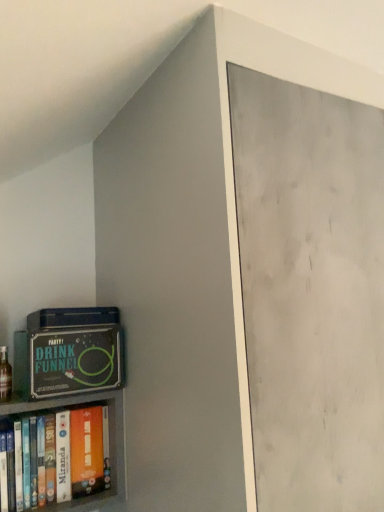
The image size is (384, 512). What are the coordinates of `orange matte book at lower left` in the screenshot? It's located at (111, 467).

Where is `green matte board game at lower left`? The height and width of the screenshot is (512, 384). green matte board game at lower left is located at coordinates (75, 360).

This screenshot has height=512, width=384. I want to click on orange matte book at lower left, so click(111, 467).

From a real-world perspective, is orange matte book at lower left on top of green matte board game at lower left?

No.

How distant is orange matte book at lower left from green matte board game at lower left?

They are 4.23 inches apart.

Is orange matte book at lower left not close to green matte board game at lower left?

orange matte book at lower left is actually quite close to green matte board game at lower left.

Can you confirm if orange matte book at lower left is bigger than green matte board game at lower left?

No.

Does point (79, 344) come farther from viewer compared to point (8, 400)?

No, (79, 344) is in front of (8, 400).

From the image's perspective, between green matte board game at lower left and translucent glass bottle at lower left, which one is located above?

green matte board game at lower left.

Can you confirm if green matte board game at lower left is taller than translucent glass bottle at lower left?

Indeed, green matte board game at lower left has a greater height compared to translucent glass bottle at lower left.

Is green matte board game at lower left oriented towards translucent glass bottle at lower left?

No, green matte board game at lower left is not turned towards translucent glass bottle at lower left.

Which of these two, translucent glass bottle at lower left or orange matte book at lower left, is thinner?

orange matte book at lower left.

Can you see translucent glass bottle at lower left touching orange matte book at lower left?

translucent glass bottle at lower left and orange matte book at lower left are not in contact.

Is point (3, 353) less distant than point (119, 451)?

That is False.

From a real-world perspective, is translucent glass bottle at lower left above or below orange matte book at lower left?

Clearly, from a real-world perspective, translucent glass bottle at lower left is above orange matte book at lower left.

Looking at their sizes, would you say translucent glass bottle at lower left is wider or thinner than green matte board game at lower left?

In the image, translucent glass bottle at lower left appears to be more narrow than green matte board game at lower left.

How different are the orientations of translucent glass bottle at lower left and green matte board game at lower left in degrees?

The angle between the facing direction of translucent glass bottle at lower left and the facing direction of green matte board game at lower left is 1.15 degrees.

Which is closer, (x=2, y=380) or (x=119, y=371)?

Positioned in front is point (x=119, y=371).

Looking at the image, does translucent glass bottle at lower left seem bigger or smaller compared to green matte board game at lower left?

In the image, translucent glass bottle at lower left appears to be smaller than green matte board game at lower left.

Between green matte board game at lower left and orange matte book at lower left, which one has more height?

orange matte book at lower left is taller.

Considering the points (40, 372) and (92, 469), which point is in front, point (40, 372) or point (92, 469)?

Positioned in front is point (40, 372).

Are green matte board game at lower left and orange matte book at lower left beside each other?

green matte board game at lower left is not next to orange matte book at lower left, and they're not touching.

Is green matte board game at lower left thinner than orange matte book at lower left?

No, green matte board game at lower left is not thinner than orange matte book at lower left.

Is orange matte book at lower left beside translucent glass bottle at lower left?

No, orange matte book at lower left is not touching translucent glass bottle at lower left.

Looking at this image, what's the angular difference between orange matte book at lower left and translucent glass bottle at lower left's facing directions?

The angle between the facing direction of orange matte book at lower left and the facing direction of translucent glass bottle at lower left is 0.101 degrees.

Between orange matte book at lower left and translucent glass bottle at lower left, which one has more height?

Standing taller between the two is orange matte book at lower left.

From the image's perspective, is orange matte book at lower left positioned above or below translucent glass bottle at lower left?

Clearly, from the image's perspective, orange matte book at lower left is below translucent glass bottle at lower left.

You are a GUI agent. You are given a task and a screenshot of the screen. Output one action in this format:
    pyautogui.click(x=<x>, y=<y>)
    Task: Click on the book below the green matte board game at lower left (from a real-world perspective)
    Image resolution: width=384 pixels, height=512 pixels.
    Given the screenshot: What is the action you would take?
    pyautogui.click(x=111, y=467)

At what (x,y) coordinates should I click in order to perform the action: click on alcohol that is below the green matte board game at lower left (from the image's perspective). Please return your answer as a coordinate pair (x, y). Looking at the image, I should click on (5, 375).

From the image, which object appears to be farther from green matte board game at lower left, orange matte book at lower left or translucent glass bottle at lower left?

Among the two, translucent glass bottle at lower left is located further to green matte board game at lower left.

Consider the image. Based on their spatial positions, is green matte board game at lower left or orange matte book at lower left closer to translucent glass bottle at lower left?

Among the two, orange matte book at lower left is located nearer to translucent glass bottle at lower left.

Which object lies further to the anchor point green matte board game at lower left, translucent glass bottle at lower left or orange matte book at lower left?

translucent glass bottle at lower left.

When comparing their distances from translucent glass bottle at lower left, does orange matte book at lower left or green matte board game at lower left seem closer?

orange matte book at lower left is closer to translucent glass bottle at lower left.

From the image, which object appears to be nearer to orange matte book at lower left, translucent glass bottle at lower left or green matte board game at lower left?

green matte board game at lower left lies closer to orange matte book at lower left than the other object.

Based on their spatial positions, is green matte board game at lower left or translucent glass bottle at lower left further from orange matte book at lower left?

The object further to orange matte book at lower left is translucent glass bottle at lower left.

Identify the location of alcohol between green matte board game at lower left and orange matte book at lower left from top to bottom. (5, 375).